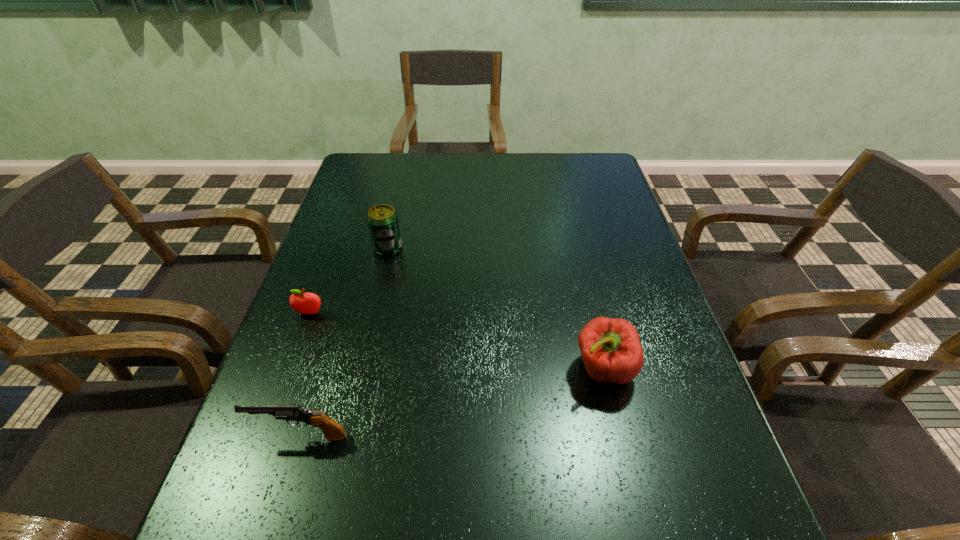
Where is `the rightmost object`? Image resolution: width=960 pixels, height=540 pixels. the rightmost object is located at coordinates (611, 350).

The height and width of the screenshot is (540, 960). In order to click on bell pepper in this screenshot , I will do `click(611, 350)`.

The width and height of the screenshot is (960, 540). I want to click on the farthest object, so click(x=382, y=220).

I want to click on the nearest object, so click(x=332, y=430).

Where is `the second farthest object`? the second farthest object is located at coordinates (304, 303).

At what (x,y) coordinates should I click in order to perform the action: click on the shortest object. Please return your answer as a coordinate pair (x, y). Image resolution: width=960 pixels, height=540 pixels. Looking at the image, I should click on (304, 303).

This screenshot has height=540, width=960. Identify the location of free region located 0.060m on the left of the third farthest object. (545, 369).

At what (x,y) coordinates should I click in order to perform the action: click on vacant region located 0.070m on the left of the farthest object. Please return your answer as a coordinate pair (x, y). Image resolution: width=960 pixels, height=540 pixels. Looking at the image, I should click on (348, 248).

This screenshot has height=540, width=960. In order to click on vacant area located on the front of the shortest object in this screenshot , I will do `click(291, 365)`.

Where is `beer can that is at the left edge`? beer can that is at the left edge is located at coordinates (382, 220).